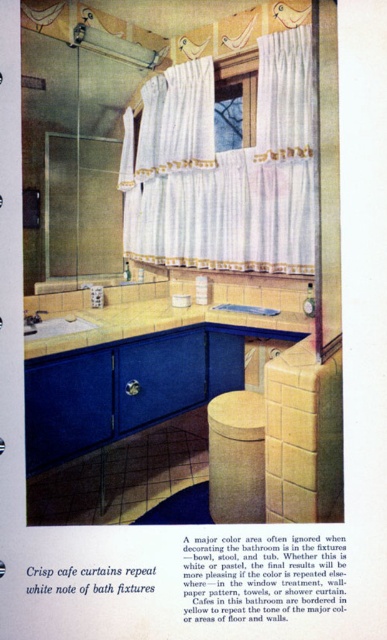
Who is higher up, white sheer curtain at upper center or matte white sink at lower left?

white sheer curtain at upper center

Does white sheer curtain at upper center have a greater width compared to matte white sink at lower left?

Yes, white sheer curtain at upper center is wider than matte white sink at lower left.

What do you see at coordinates (227, 170) in the screenshot?
I see `white sheer curtain at upper center` at bounding box center [227, 170].

Where is `white sheer curtain at upper center`? white sheer curtain at upper center is located at coordinates (227, 170).

Who is positioned more to the left, matte white sink at lower left or brushed metal faucet at lower left?

brushed metal faucet at lower left

Can you confirm if matte white sink at lower left is wider than brushed metal faucet at lower left?

Indeed, matte white sink at lower left has a greater width compared to brushed metal faucet at lower left.

Is point (42, 324) positioned after point (25, 317)?

Yes, point (42, 324) is behind point (25, 317).

Find the location of a particular element. matte white sink at lower left is located at coordinates (54, 324).

Is wooden textured stool at center taller than brushed metal faucet at lower left?

Indeed, wooden textured stool at center has a greater height compared to brushed metal faucet at lower left.

Is wooden textured stool at center bigger than brushed metal faucet at lower left?

Indeed, wooden textured stool at center has a larger size compared to brushed metal faucet at lower left.

Which is in front, point (251, 518) or point (32, 321)?

Point (251, 518) is more forward.

Locate an element on the screen. The image size is (387, 640). wooden textured stool at center is located at coordinates (236, 458).